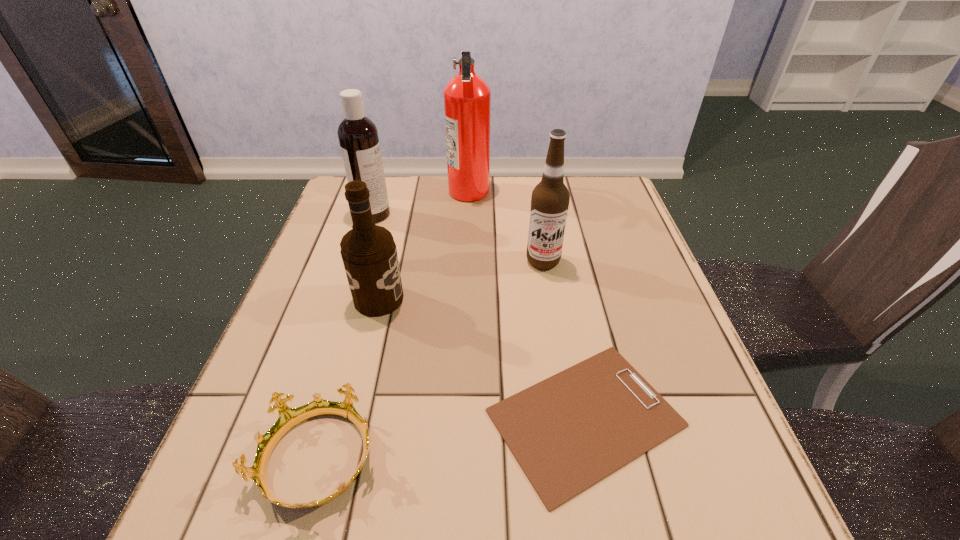
At what (x,y) coordinates should I click in order to perform the action: click on free space between the dishwasher detergent and the tallest object. Please return your answer as a coordinate pair (x, y). The width and height of the screenshot is (960, 540). Looking at the image, I should click on (x=421, y=202).

The width and height of the screenshot is (960, 540). Find the location of `vacant space in between the second shortest object and the dishwasher detergent`. vacant space in between the second shortest object and the dishwasher detergent is located at coordinates (346, 338).

Image resolution: width=960 pixels, height=540 pixels. I want to click on vacant space that's between the clipboard and the crown, so click(x=452, y=439).

At what (x,y) coordinates should I click in order to perform the action: click on vacant space that's between the clipboard and the crown. Please return your answer as a coordinate pair (x, y). Looking at the image, I should click on (452, 439).

This screenshot has width=960, height=540. I want to click on free space between the shortest object and the third farthest object, so click(x=564, y=340).

The width and height of the screenshot is (960, 540). In order to click on empty space between the third shortest object and the clipboard in this screenshot , I will do `click(482, 359)`.

Find the location of a particular element. empty location between the fire extinguisher and the shorter alcohol is located at coordinates (424, 245).

This screenshot has width=960, height=540. Identify the location of vacant region between the nearer alcohol and the crown. (348, 380).

Identify which object is the fifth closest to the fourth nearest object. Please provide its 2D coordinates. Your answer should be formatted as a tuple, i.e. [(x, y)], where the tuple contains the x and y coordinates of a point satisfying the conditions above.

[(288, 418)]

Locate an element on the screen. object that is the third nearest to the crown is located at coordinates (550, 199).